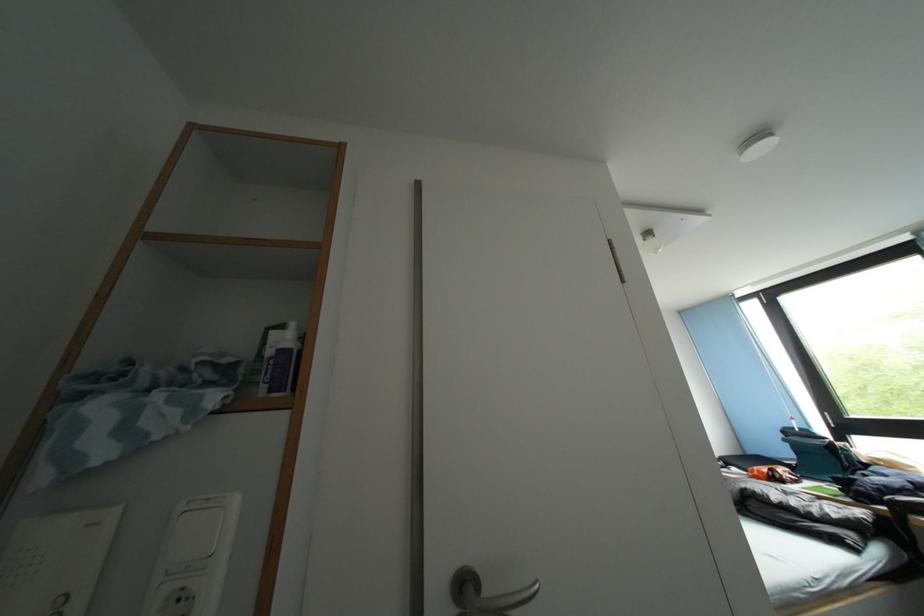
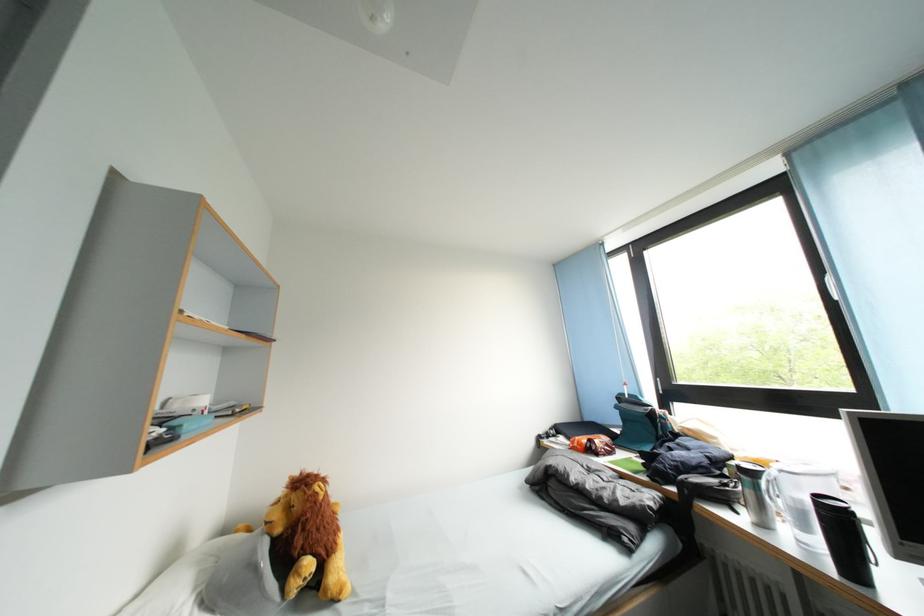
In a continuous first-person perspective shot, in which direction is the camera moving?

The cameraman moved toward right, forward.